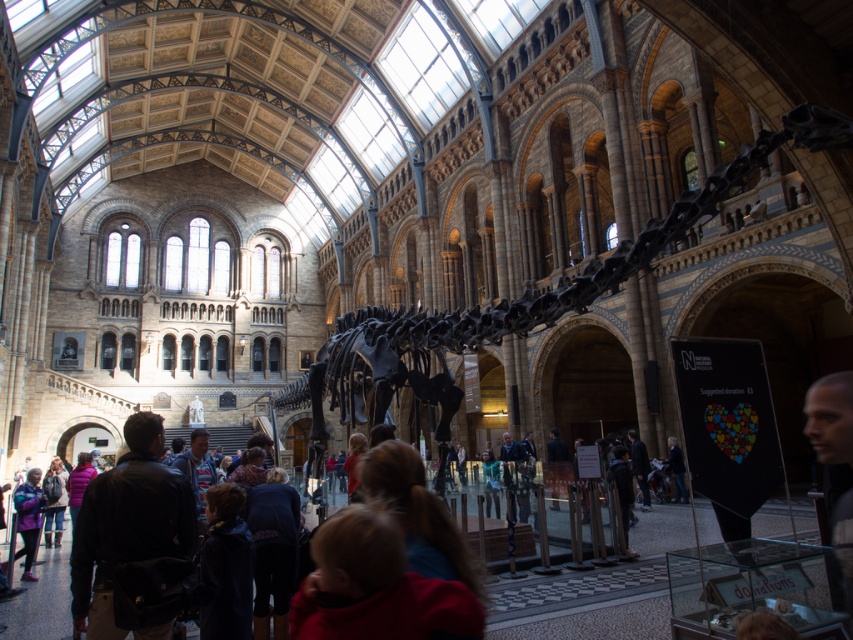
Is red fleece jacket at center smaller than matte purple jacket at lower left?

Indeed, red fleece jacket at center has a smaller size compared to matte purple jacket at lower left.

Does red fleece jacket at center appear over matte purple jacket at lower left?

Yes, red fleece jacket at center is above matte purple jacket at lower left.

Does point (370, 598) come in front of point (32, 552)?

That is True.

The width and height of the screenshot is (853, 640). What are the coordinates of `red fleece jacket at center` in the screenshot? It's located at (375, 586).

Can you confirm if black matte skeleton at center is bigger than matte purple jacket at lower left?

Yes.

Who is more forward, (498, 317) or (32, 531)?

Positioned in front is point (498, 317).

Identify the location of black matte skeleton at center. (514, 301).

Does black leather jacket at center have a larger size compared to matte purple jacket at lower left?

No, black leather jacket at center is not bigger than matte purple jacket at lower left.

Does black leather jacket at center have a smaller size compared to matte purple jacket at lower left?

Indeed, black leather jacket at center has a smaller size compared to matte purple jacket at lower left.

Is point (96, 513) farther from viewer compared to point (33, 502)?

No, (96, 513) is closer to viewer.

This screenshot has width=853, height=640. I want to click on black leather jacket at center, so click(x=126, y=524).